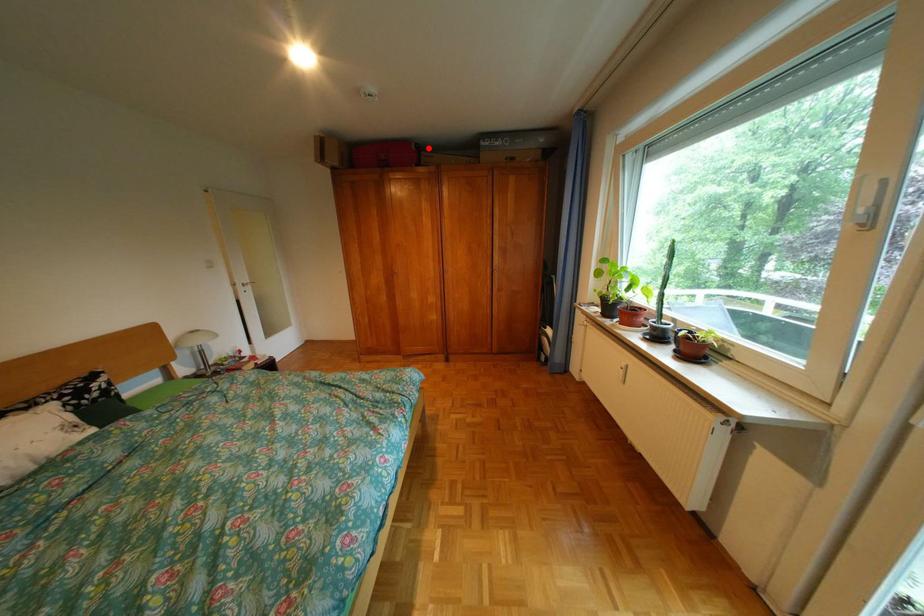
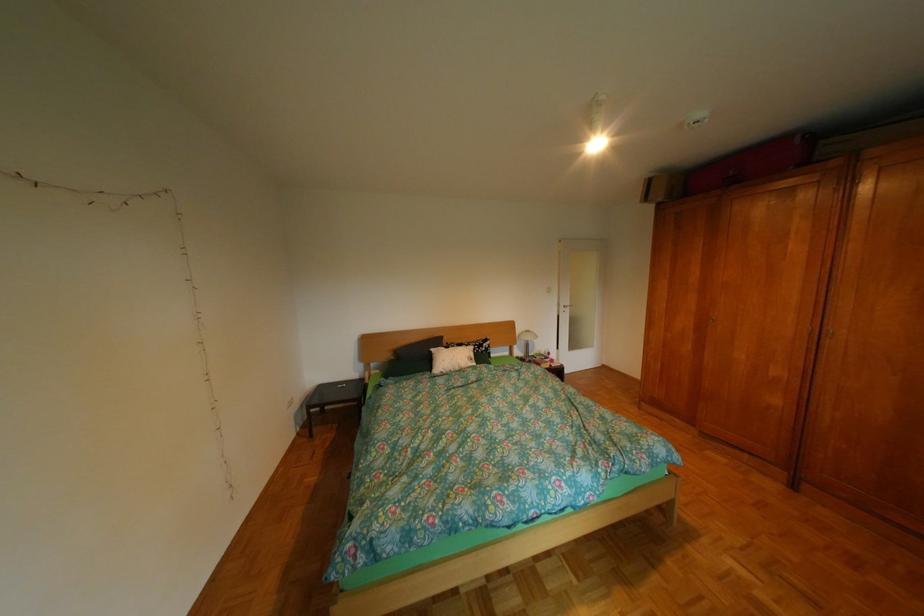
Find the pixel in the second image that matches the highlighted location in the first image.

(812, 142)